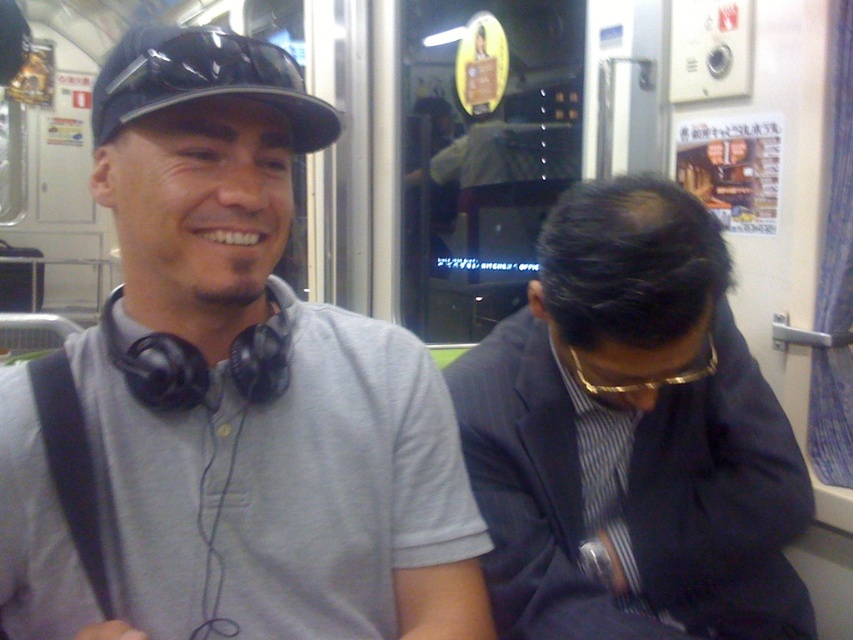
Question: Does gray matte shirt at center come behind black glossy baseball cap at upper left?

Choices:
 (A) yes
 (B) no

Answer: (B)

Question: Is gray matte shirt at center to the left of dark blue pinstripe suit at center from the viewer's perspective?

Choices:
 (A) yes
 (B) no

Answer: (A)

Question: Is gray matte shirt at center bigger than dark blue pinstripe suit at center?

Choices:
 (A) no
 (B) yes

Answer: (A)

Question: Which point is closer to the camera taking this photo?

Choices:
 (A) (624, 509)
 (B) (131, 112)

Answer: (B)

Question: Which point is farther from the camera taking this photo?

Choices:
 (A) (287, 592)
 (B) (277, 58)

Answer: (A)

Question: Estimate the real-world distances between objects in this image. Which object is farther from the dark blue pinstripe suit at center?

Choices:
 (A) black glossy baseball cap at upper left
 (B) gray matte shirt at center

Answer: (A)